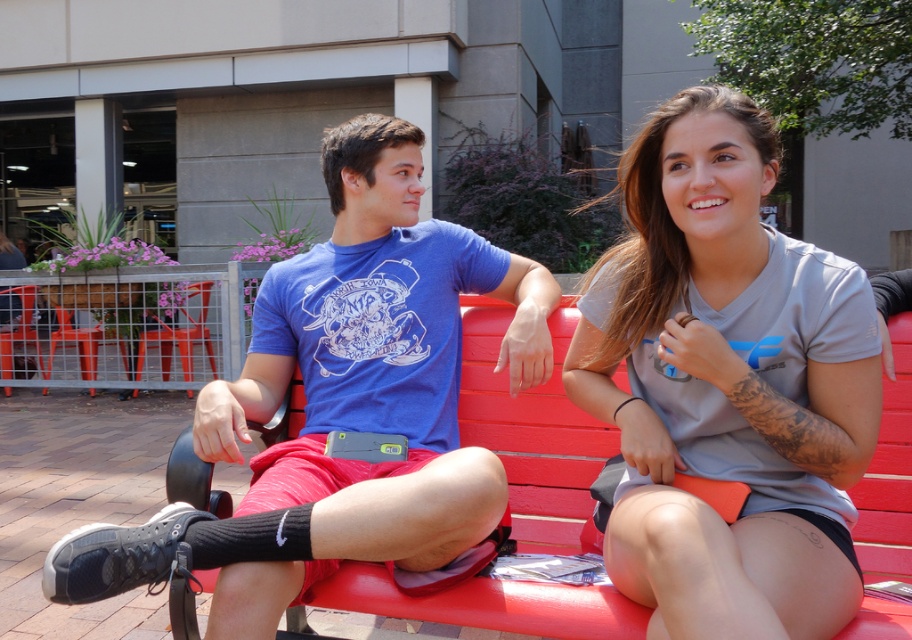
Question: Which object is positioned farthest from the matte blue t-shirt at center?

Choices:
 (A) red wood bench at center
 (B) gray matte t-shirt at center

Answer: (B)

Question: Which object appears closest to the camera in this image?

Choices:
 (A) matte blue t-shirt at center
 (B) gray matte t-shirt at center
 (C) red wood bench at center

Answer: (B)

Question: Can you confirm if gray matte t-shirt at center is positioned below matte blue t-shirt at center?

Choices:
 (A) yes
 (B) no

Answer: (B)

Question: Is matte blue t-shirt at center thinner than red wood bench at center?

Choices:
 (A) yes
 (B) no

Answer: (B)

Question: Estimate the real-world distances between objects in this image. Which object is closer to the red wood bench at center?

Choices:
 (A) matte blue t-shirt at center
 (B) gray matte t-shirt at center

Answer: (A)

Question: Does gray matte t-shirt at center come behind matte blue t-shirt at center?

Choices:
 (A) no
 (B) yes

Answer: (A)